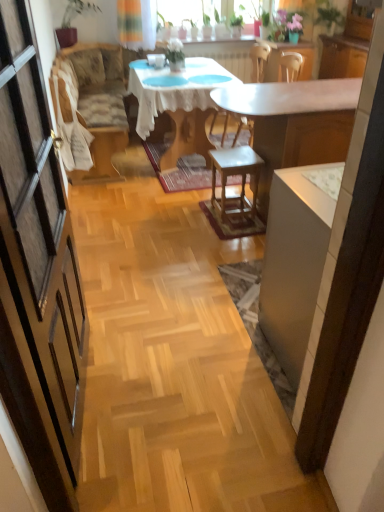
Question: Considering the positions of patterned fabric couch at left and wooden stool at center in the image, is patterned fabric couch at left wider or thinner than wooden stool at center?

Choices:
 (A) thin
 (B) wide

Answer: (B)

Question: In terms of height, does patterned fabric couch at left look taller or shorter compared to wooden stool at center?

Choices:
 (A) short
 (B) tall

Answer: (B)

Question: Estimate the real-world distances between objects in this image. Which object is closer to the wooden stool at center?

Choices:
 (A) patterned fabric couch at left
 (B) green matte plant at upper center
 (C) white glossy desk at center
 (D) white glossy cabinet at right
 (E) white lace tablecloth at center

Answer: (C)

Question: Which object is the farthest from the wooden stool at center?

Choices:
 (A) white lace tablecloth at center
 (B) white glossy desk at center
 (C) green matte plant at upper center
 (D) white glossy cabinet at right
 (E) patterned fabric couch at left

Answer: (C)